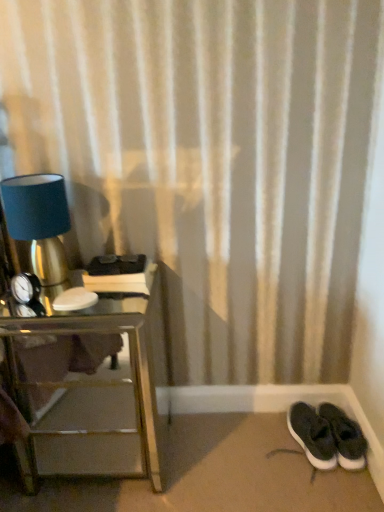
This screenshot has width=384, height=512. I want to click on vacant area in front of black suede sneakers at lower right, so click(321, 484).